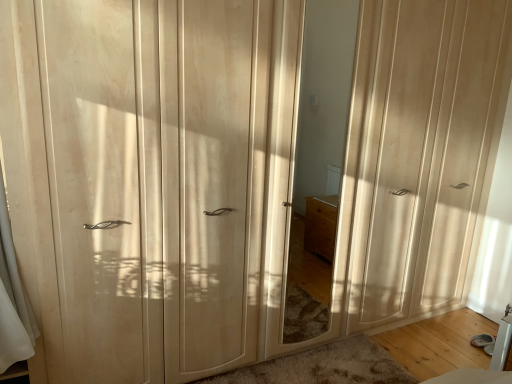
Question: From the image's perspective, is matte wood wardrobe at right, acting as the second screen door starting from the left, on top of matte wood mirror at center?

Choices:
 (A) no
 (B) yes

Answer: (B)

Question: Is matte wood wardrobe at right, acting as the second screen door starting from the left, positioned beyond the bounds of matte wood mirror at center?

Choices:
 (A) no
 (B) yes

Answer: (B)

Question: From a real-world perspective, is matte wood wardrobe at right, acting as the first screen door starting from the right, located beneath matte wood mirror at center?

Choices:
 (A) yes
 (B) no

Answer: (B)

Question: Is matte wood wardrobe at right, acting as the second screen door starting from the left, bigger than matte wood mirror at center?

Choices:
 (A) no
 (B) yes

Answer: (B)

Question: Is matte wood wardrobe at right, acting as the second screen door starting from the left, thinner than matte wood mirror at center?

Choices:
 (A) no
 (B) yes

Answer: (A)

Question: Is point (268, 271) positioned closer to the camera than point (181, 334)?

Choices:
 (A) farther
 (B) closer

Answer: (A)

Question: From a real-world perspective, is matte wood mirror at center above or below matte wood wardrobe at left, marked as the first screen door in a left-to-right arrangement?

Choices:
 (A) above
 (B) below

Answer: (A)

Question: In the image, is matte wood mirror at center positioned in front of or behind matte wood wardrobe at left, which ranks as the 2th screen door in right-to-left order?

Choices:
 (A) front
 (B) behind

Answer: (B)

Question: Considering the positions of matte wood mirror at center and matte wood wardrobe at left, marked as the first screen door in a left-to-right arrangement, in the image, is matte wood mirror at center taller or shorter than matte wood wardrobe at left, marked as the first screen door in a left-to-right arrangement,?

Choices:
 (A) short
 (B) tall

Answer: (A)

Question: Is matte wood wardrobe at left, marked as the first screen door in a left-to-right arrangement, inside the boundaries of matte wood wardrobe at right, acting as the first screen door starting from the right, or outside?

Choices:
 (A) outside
 (B) inside

Answer: (A)

Question: Is matte wood wardrobe at left, which ranks as the 2th screen door in right-to-left order, taller or shorter than matte wood wardrobe at right, acting as the second screen door starting from the left?

Choices:
 (A) tall
 (B) short

Answer: (B)

Question: Considering the positions of matte wood wardrobe at left, marked as the first screen door in a left-to-right arrangement, and matte wood wardrobe at right, acting as the first screen door starting from the right, in the image, is matte wood wardrobe at left, marked as the first screen door in a left-to-right arrangement, wider or thinner than matte wood wardrobe at right, acting as the first screen door starting from the right,?

Choices:
 (A) thin
 (B) wide

Answer: (B)

Question: Is point (189, 195) closer or farther from the camera than point (426, 198)?

Choices:
 (A) farther
 (B) closer

Answer: (B)

Question: Considering the positions of point (146, 206) and point (266, 220), is point (146, 206) closer or farther from the camera than point (266, 220)?

Choices:
 (A) closer
 (B) farther

Answer: (A)

Question: In terms of width, does matte wood wardrobe at left, which ranks as the 2th screen door in right-to-left order, look wider or thinner when compared to matte wood mirror at center?

Choices:
 (A) thin
 (B) wide

Answer: (B)